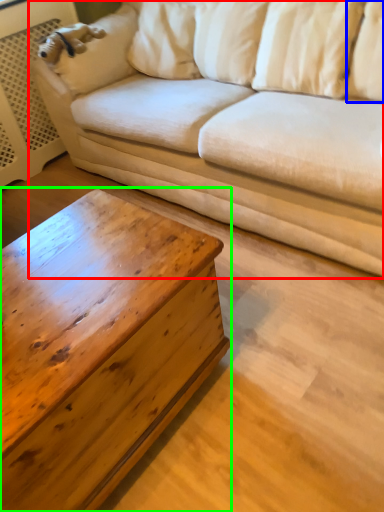
Question: Which is farther away from studio couch (highlighted by a red box)? pillow (highlighted by a blue box) or coffee table (highlighted by a green box)?

Choices:
 (A) pillow
 (B) coffee table

Answer: (B)